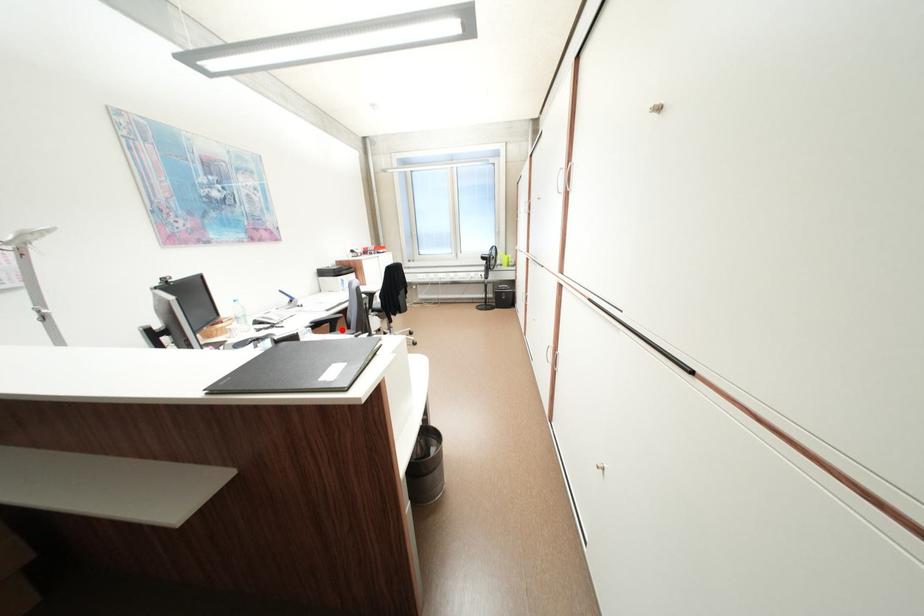
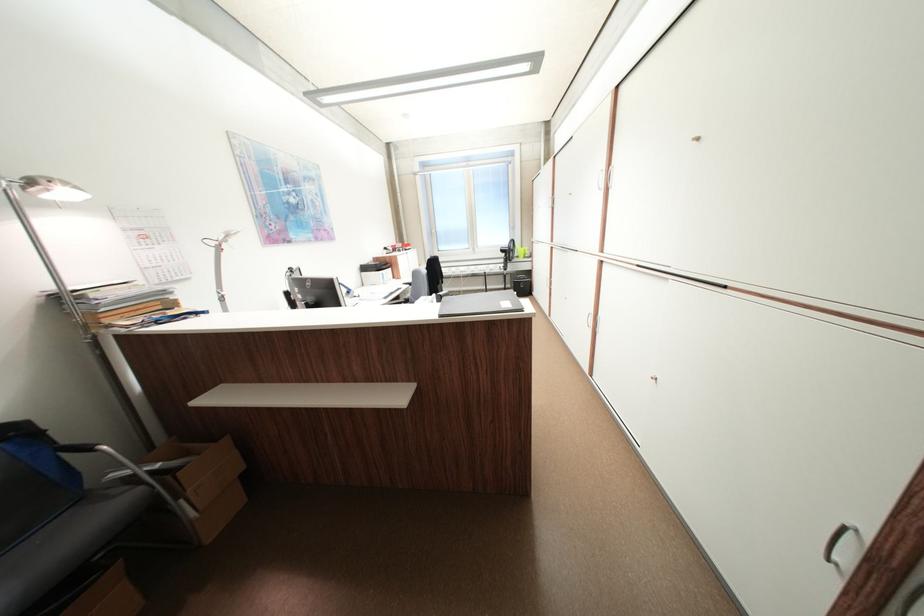
Question: I am providing you with two images of the same scene from different viewpoints. A red point is marked on the first image. At the location where the point appears in image 1, is it still visible in image 2?

Choices:
 (A) Yes
 (B) No

Answer: (B)